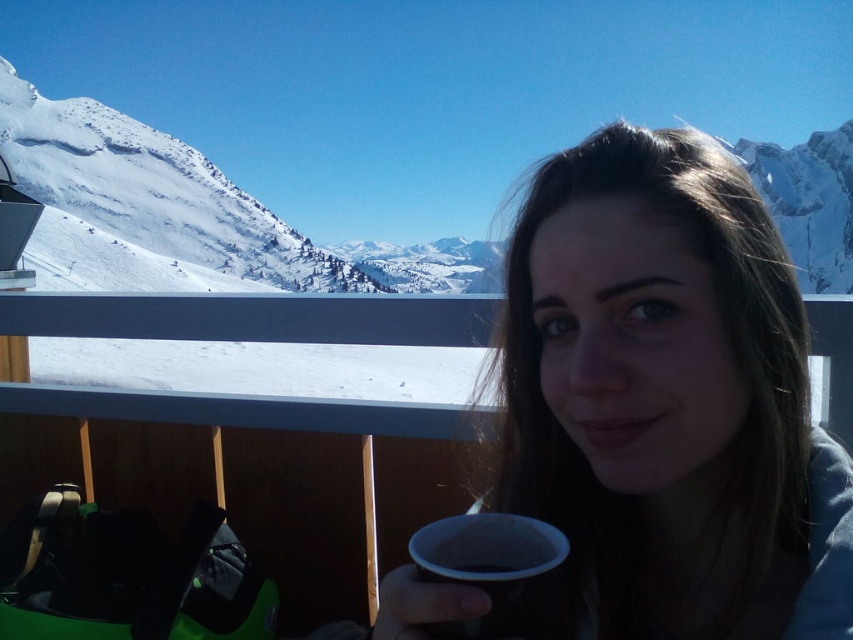
Between matte black cup at center and snowy white mountain at upper left, which one is positioned lower?

matte black cup at center is lower down.

Between matte black cup at center and snowy white mountain at upper left, which one has more height?

With more height is snowy white mountain at upper left.

Between point (732, 524) and point (161, 228), which one is positioned in front?

Point (732, 524) is in front.

Where is `matte black cup at center`? matte black cup at center is located at coordinates (668, 400).

Who is taller, snowy white mountain at upper left or black ceramic cup at lower center?

With more height is snowy white mountain at upper left.

Can you confirm if snowy white mountain at upper left is bigger than black ceramic cup at lower center?

Yes, snowy white mountain at upper left is bigger than black ceramic cup at lower center.

Is point (91, 164) closer to camera compared to point (463, 627)?

No.

Locate an element on the screen. snowy white mountain at upper left is located at coordinates 198,209.

Can you confirm if black matte cup at lower center is taller than white matte cup at lower center?

No.

Which of these two, black matte cup at lower center or white matte cup at lower center, stands taller?

With more height is white matte cup at lower center.

Image resolution: width=853 pixels, height=640 pixels. Describe the element at coordinates (495, 545) in the screenshot. I see `black matte cup at lower center` at that location.

You are a GUI agent. You are given a task and a screenshot of the screen. Output one action in this format:
    pyautogui.click(x=<x>, y=<y>)
    Task: Click on the black matte cup at lower center
    Image resolution: width=853 pixels, height=640 pixels.
    Given the screenshot: What is the action you would take?
    pyautogui.click(x=495, y=545)